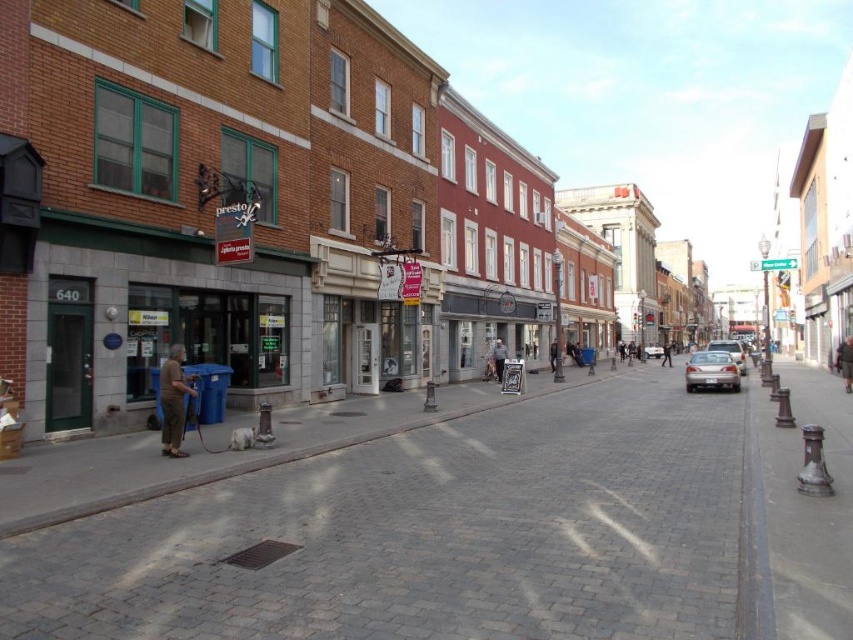
You are a fashion designer observing the urban street scene. You notice two jackets, the brown leather jacket at center and the dark gray leather jacket at center. Which jacket is placed above the other?

The brown leather jacket at center is positioned over the dark gray leather jacket at center.

You are standing in the middle of the street and see a point marked at coordinates (x=845, y=362). Which object does this point correspond to?

The point at coordinates (x=845, y=362) corresponds to the brown leather jacket at center.

You are a delivery person needing to park your motorcycle between the silver metallic sedan at center and the dark blue jeans at center. Is there enough space between them for your motorcycle?

The silver metallic sedan at center is to the left of dark blue jeans at center, so there is space between them. However, the exact width isn not provided, so it depends on the motorcycle size.